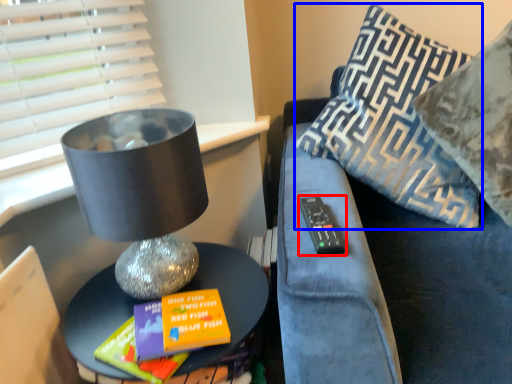
Question: Which of the following is the closest to the observer, remote (highlighted by a red box) or pillow (highlighted by a blue box)?

Choices:
 (A) remote
 (B) pillow

Answer: (A)